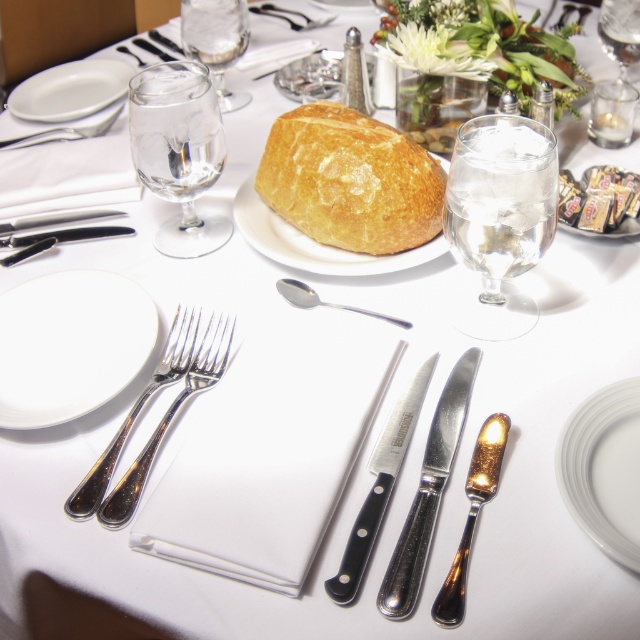
Question: Is gold plated butter knife at center thinner than clear glass wine glass at upper right?

Choices:
 (A) yes
 (B) no

Answer: (B)

Question: Based on their relative distances, which object is nearer to the white ceramic plate at center?

Choices:
 (A) polished silver fork at lower left
 (B) golden crusty loaf of bread at center

Answer: (B)

Question: Can you confirm if white glossy plate at center is smaller than black polished knife at center?

Choices:
 (A) yes
 (B) no

Answer: (A)

Question: Considering the relative positions of gold plated butter knife at center and polished silver spoon at center in the image provided, where is gold plated butter knife at center located with respect to polished silver spoon at center?

Choices:
 (A) left
 (B) right

Answer: (B)

Question: Which of the following is the closest to the observer?

Choices:
 (A) polished silver fork at lower left
 (B) white porcelain plate at left
 (C) clear glass wine glass at upper right

Answer: (A)

Question: Which point appears closest to the camera in this image?

Choices:
 (A) (380, 589)
 (B) (529, 156)

Answer: (A)